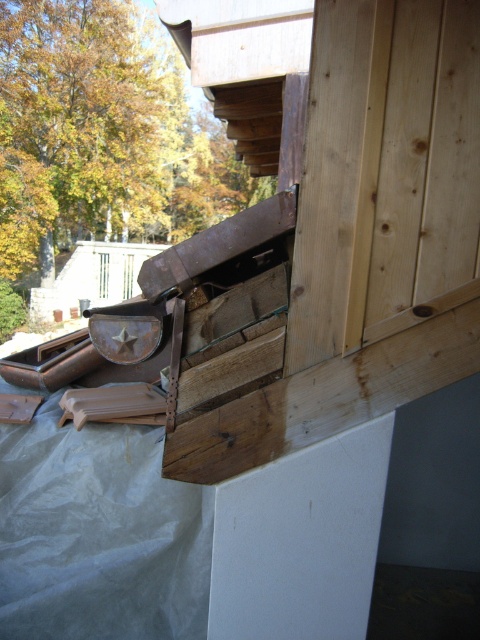
Where is `brown wood window at upper center`? The height and width of the screenshot is (640, 480). brown wood window at upper center is located at coordinates (104, 275).

Between point (107, 285) and point (128, 269), which one is positioned in front?

Point (128, 269) is in front.

Who is more distant from viewer, (99, 280) or (132, 276)?

The point (99, 280) is behind.

I want to click on brown wood window at upper center, so click(x=104, y=275).